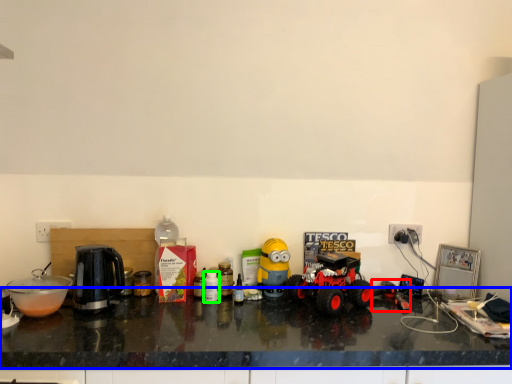
Question: Which object is the closest to the toy (highlighted by a red box)? Choose among these: countertop (highlighted by a blue box) or bottle (highlighted by a green box).

Choices:
 (A) countertop
 (B) bottle

Answer: (A)